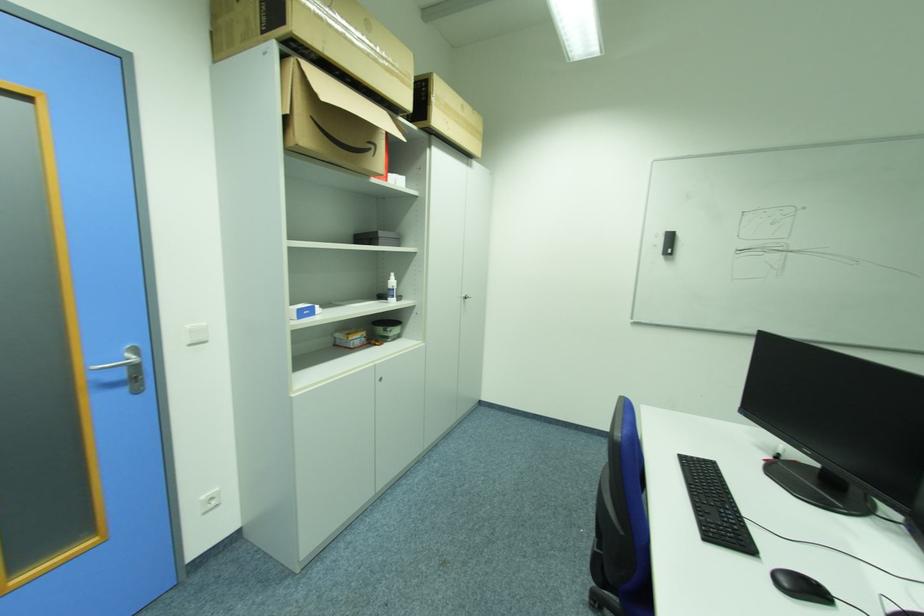
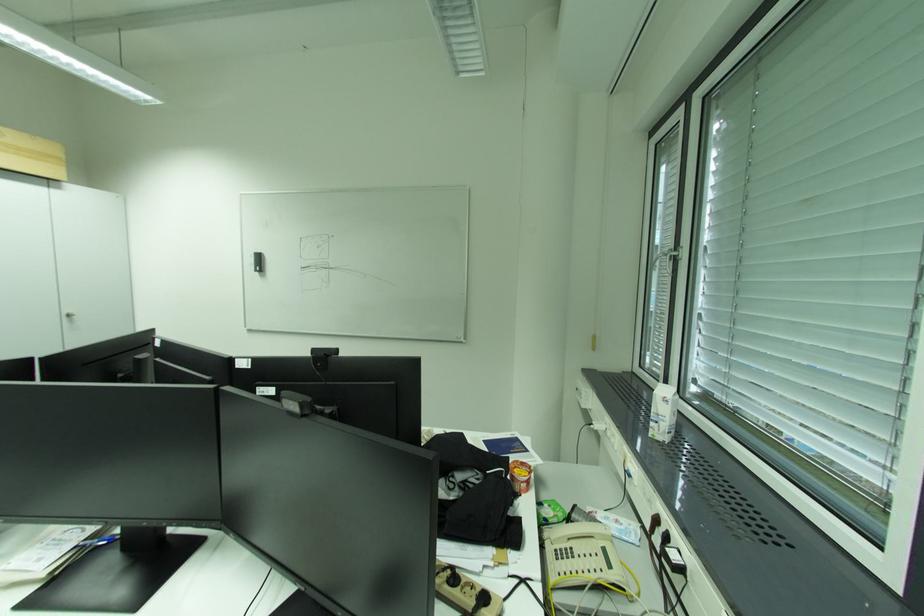
In a continuous first-person perspective shot, in which direction is the camera moving?

The cameraman walked toward right, backward.